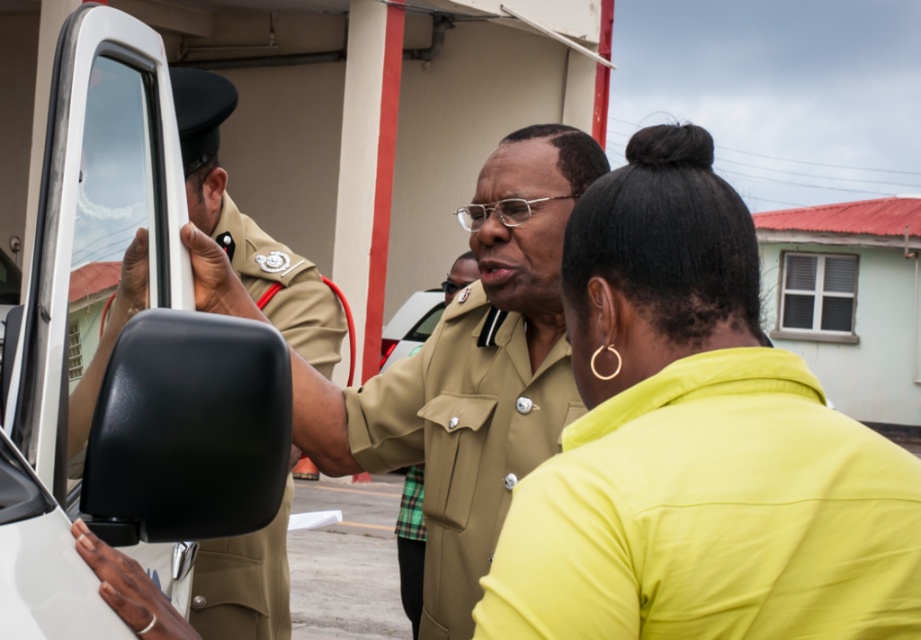
Does yellow matte shirt at center appear on the right side of matte khaki uniform at left?

Indeed, yellow matte shirt at center is positioned on the right side of matte khaki uniform at left.

Can you confirm if yellow matte shirt at center is bigger than matte khaki uniform at left?

No.

Who is more distant from viewer, [574,227] or [313,310]?

The point [313,310] is more distant.

Where is `yellow matte shirt at center`? Image resolution: width=921 pixels, height=640 pixels. yellow matte shirt at center is located at coordinates (696, 444).

Does yellow matte shirt at center lie in front of kaki fabric uniform at center?

Yes, it is in front of kaki fabric uniform at center.

Between point (775, 356) and point (435, 572), which one is positioned behind?

Positioned behind is point (435, 572).

You are a GUI agent. You are given a task and a screenshot of the screen. Output one action in this format:
    pyautogui.click(x=<x>, y=<y>)
    Task: Click on the yellow matte shirt at center
    The width and height of the screenshot is (921, 640).
    Given the screenshot: What is the action you would take?
    pyautogui.click(x=696, y=444)

Who is more distant from viewer, (484, 410) or (267, 609)?

The point (267, 609) is more distant.

Find the location of a particular element. The width and height of the screenshot is (921, 640). kaki fabric uniform at center is located at coordinates (463, 438).

You are a GUI agent. You are given a task and a screenshot of the screen. Output one action in this format:
    pyautogui.click(x=<x>, y=<y>)
    Task: Click on the kaki fabric uniform at center
    This screenshot has height=640, width=921.
    Given the screenshot: What is the action you would take?
    coord(463,438)